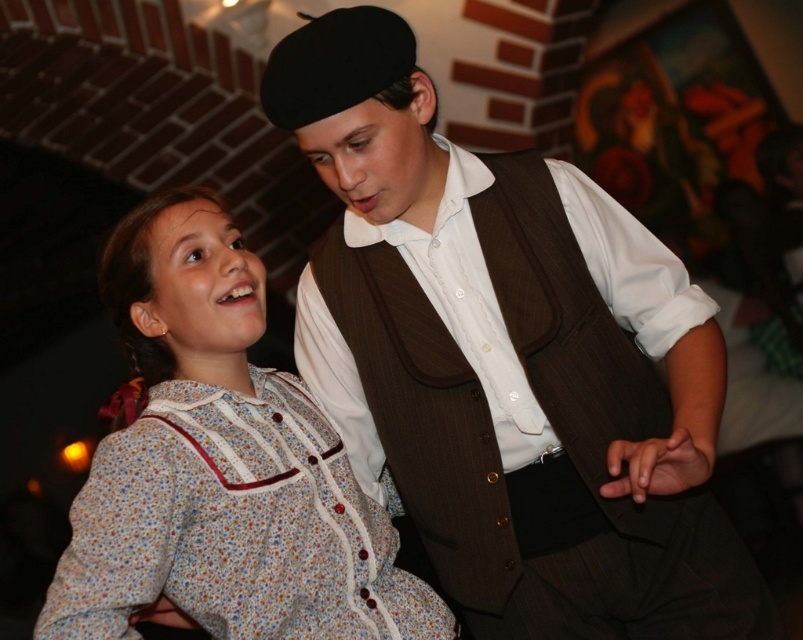
Does brown pinstripe vest at center have a lesser width compared to floral cotton dress at center?

No, brown pinstripe vest at center is not thinner than floral cotton dress at center.

In order to click on brown pinstripe vest at center in this screenshot , I will do `click(508, 360)`.

Measure the distance between brown pinstripe vest at center and camera.

brown pinstripe vest at center is 1.19 meters away from camera.

You are a GUI agent. You are given a task and a screenshot of the screen. Output one action in this format:
    pyautogui.click(x=<x>, y=<y>)
    Task: Click on the brown pinstripe vest at center
    Image resolution: width=803 pixels, height=640 pixels.
    Given the screenshot: What is the action you would take?
    pyautogui.click(x=508, y=360)